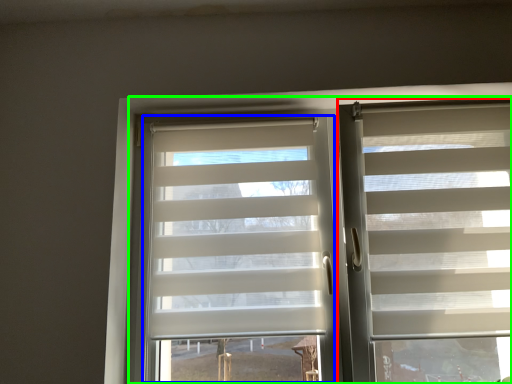
Question: Which object is the closest to the window blind (highlighted by a red box)? Choose among these: glass door (highlighted by a blue box) or bay window (highlighted by a green box).

Choices:
 (A) glass door
 (B) bay window

Answer: (B)